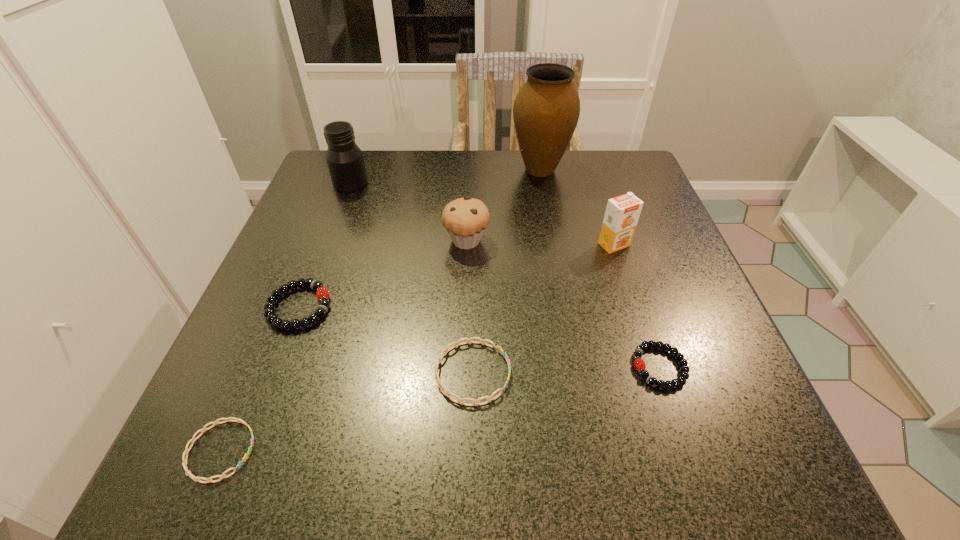
This screenshot has height=540, width=960. In order to click on vacant space located on the back of the right black bracelet in this screenshot , I will do `click(636, 295)`.

Locate an element on the screen. The width and height of the screenshot is (960, 540). vacant space situated 0.270m on the surface of the nearest object showing star-shaped elements is located at coordinates (450, 450).

Image resolution: width=960 pixels, height=540 pixels. I want to click on urn positioned at the far edge, so click(546, 110).

Image resolution: width=960 pixels, height=540 pixels. Identify the location of jar that is at the far edge. (344, 158).

Find the location of a particular element. object located in the near edge section of the desktop is located at coordinates 184,463.

Locate an element on the screen. jar present at the left edge is located at coordinates (344, 158).

Locate an element on the screen. orange juice present at the right edge is located at coordinates (622, 213).

Locate an element on the screen. The image size is (960, 540). bracelet that is at the right edge is located at coordinates (639, 364).

Locate an element on the screen. This screenshot has height=540, width=960. object located in the far left corner section of the desktop is located at coordinates (344, 158).

This screenshot has height=540, width=960. Identify the location of object present at the near left corner. click(184, 463).